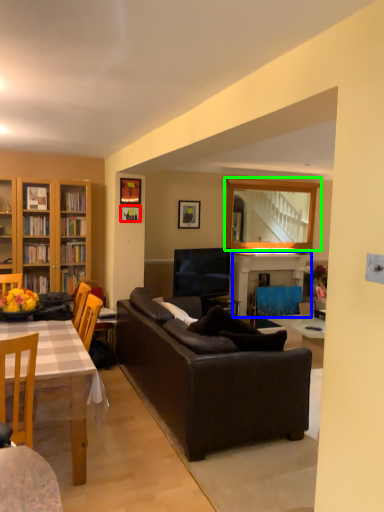
Question: Estimate the real-world distances between objects in this image. Which object is farther from picture frame (highlighted by a red box), fireplace (highlighted by a blue box) or mirror (highlighted by a green box)?

Choices:
 (A) fireplace
 (B) mirror

Answer: (B)